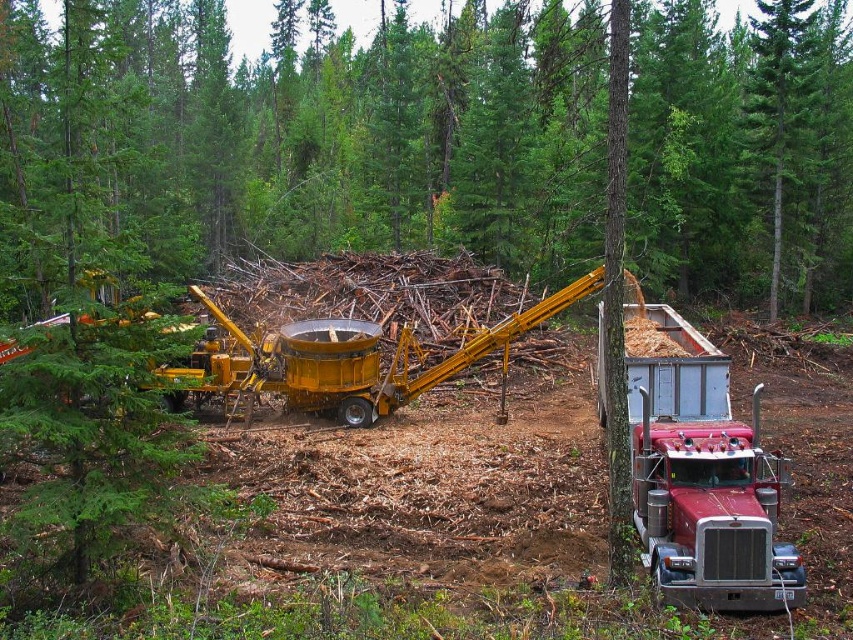
You are a safety inspector checking the logging site. You notice the green textured pine forest at center and the yellow metallic excavator at center. Which object is located above the other?

The green textured pine forest at center is positioned over yellow metallic excavator at center, meaning the forest is above the excavator.